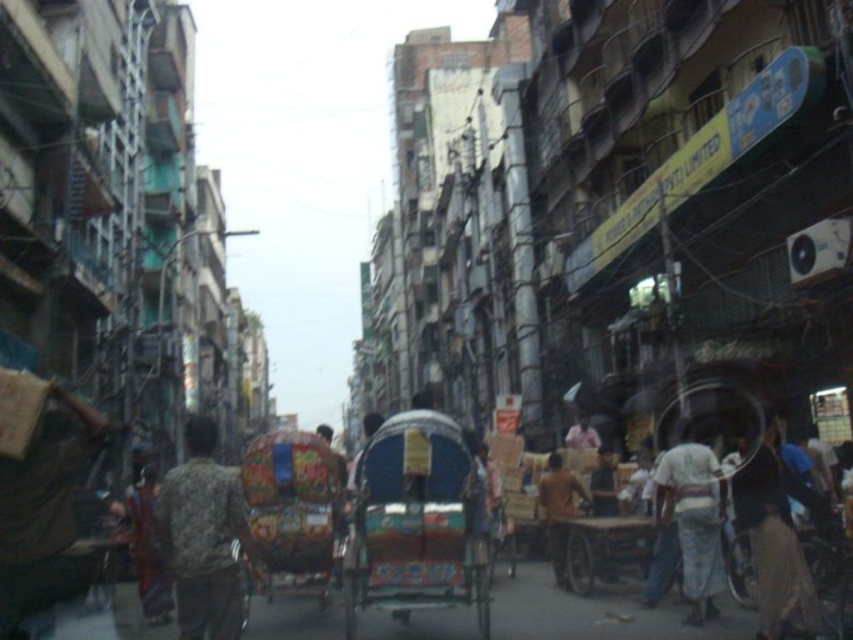
Question: Which is nearer to the brown fabric bag at left?

Choices:
 (A) dark blue fabric at center
 (B) camouflage fabric jacket at center

Answer: (B)

Question: Which point appears farthest from the camera in this image?

Choices:
 (A) (215, 515)
 (B) (3, 509)
 (C) (799, 556)
 (D) (576, 436)

Answer: (D)

Question: Where is light brown fabric bag at lower right located in relation to white cotton shirt at center in the image?

Choices:
 (A) above
 (B) below

Answer: (A)

Question: Which of the following is the closest to the observer?

Choices:
 (A) dark blue fabric at center
 (B) wooden cart at center

Answer: (B)

Question: Is decorative painted cart at center above brown fabric bag at left?

Choices:
 (A) no
 (B) yes

Answer: (A)

Question: Does decorative painted cart at center come in front of wooden cart at center?

Choices:
 (A) yes
 (B) no

Answer: (A)